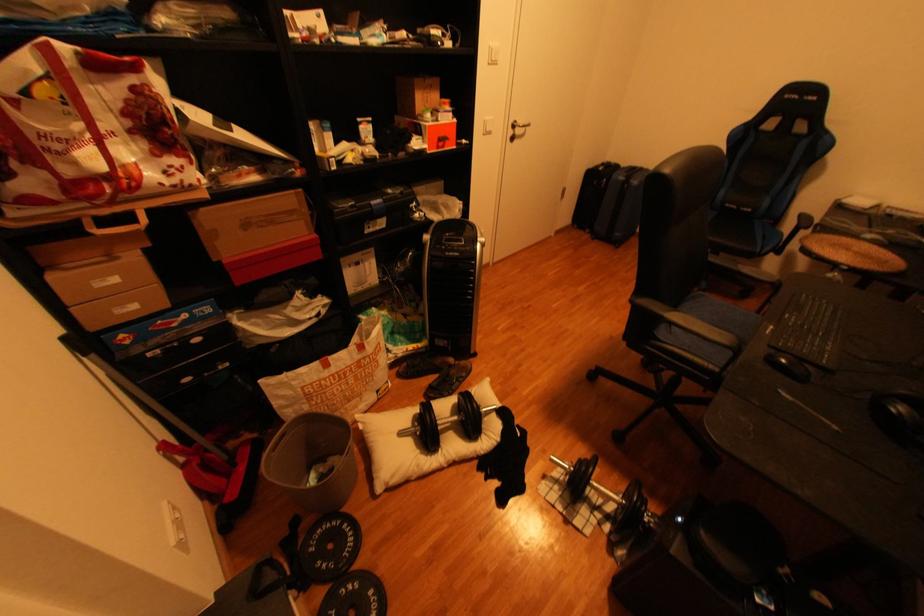
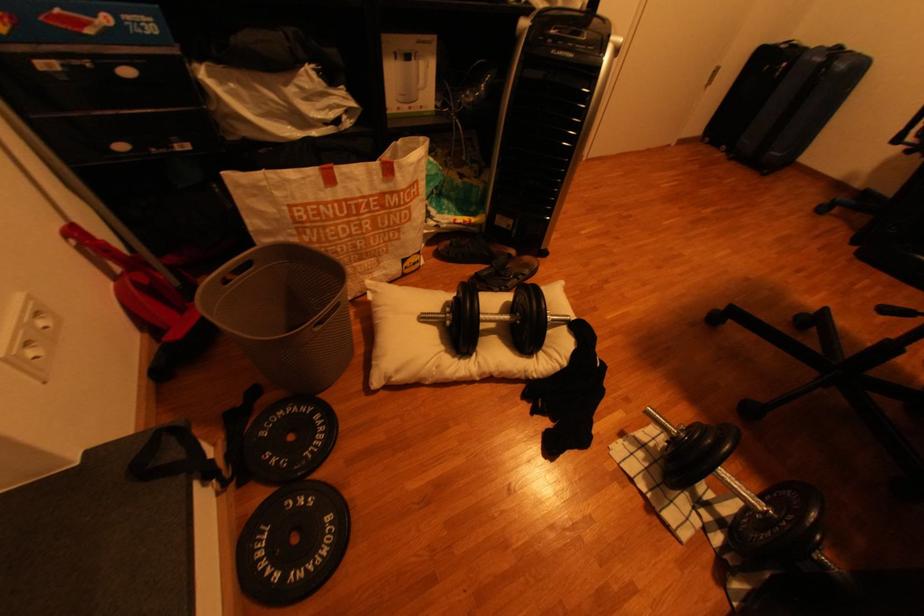
Question: The first image is from the beginning of the video and the second image is from the end. How did the camera likely rotate when shooting the video?

Choices:
 (A) Left
 (B) Right
 (C) Up
 (D) Down

Answer: (D)